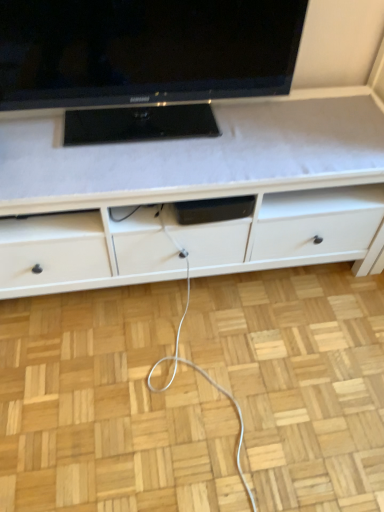
In order to click on free space in front of black glossy tv at upper center in this screenshot , I will do `click(137, 163)`.